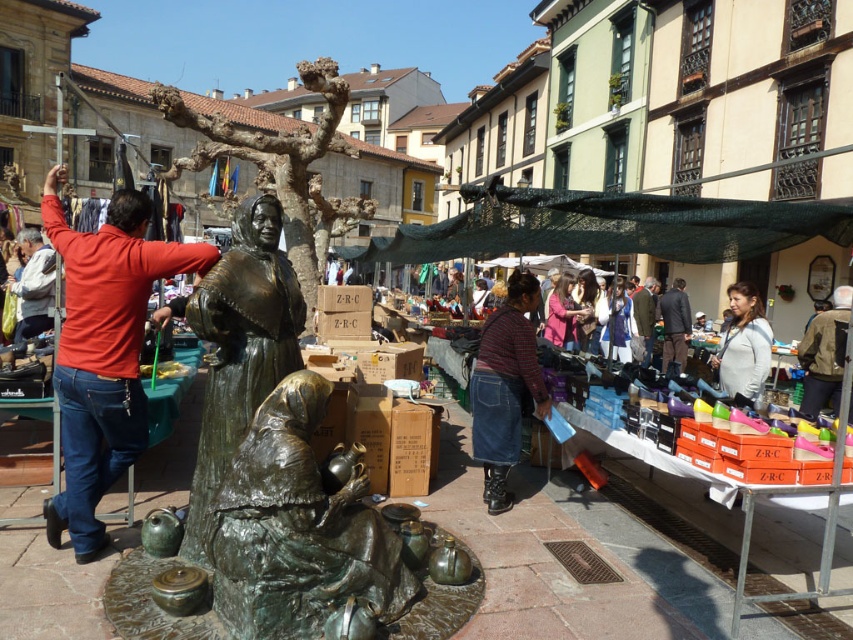
Question: Does striped fabric shirt at center have a smaller size compared to green fabric coat at center?

Choices:
 (A) yes
 (B) no

Answer: (A)

Question: From the image, what is the correct spatial relationship of gray sweater at right in relation to khaki fabric jacket at lower right?

Choices:
 (A) right
 (B) left

Answer: (B)

Question: Estimate the real-world distances between objects in this image. Which object is farther from the dark brown suit at center?

Choices:
 (A) khaki fabric jacket at lower right
 (B) red cotton shirt at left
 (C) bronze statue at center
 (D) striped fabric shirt at center

Answer: (B)

Question: Which object is positioned closest to the red cotton shirt at left?

Choices:
 (A) green fabric coat at center
 (B) khaki fabric jacket at lower right
 (C) gray sweater at right
 (D) bronze statue at center

Answer: (D)

Question: Is bronze statue at center positioned in front of green fabric coat at center?

Choices:
 (A) no
 (B) yes

Answer: (B)

Question: Which object appears closest to the camera in this image?

Choices:
 (A) bronze statue at center
 (B) khaki fabric jacket at lower right

Answer: (A)